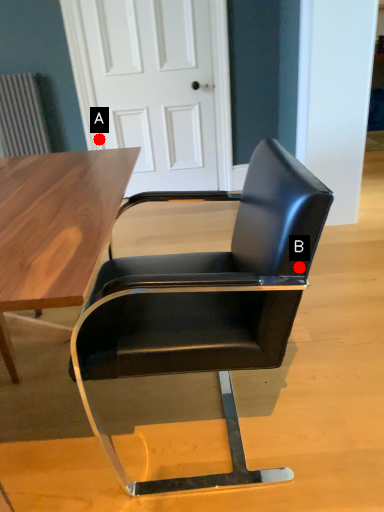
Question: Two points are circled on the image, labeled by A and B beside each circle. Among these points, which one is farthest from the camera?

Choices:
 (A) A is further
 (B) B is further

Answer: (A)